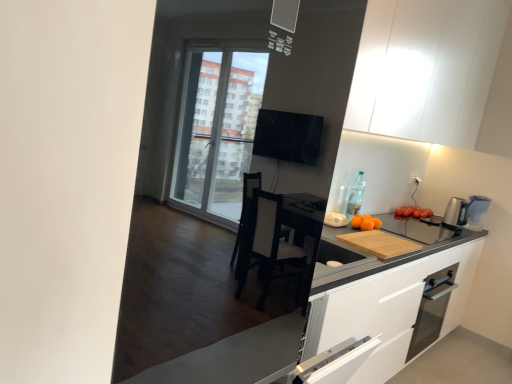
Question: Is wooden cutting board at right wider than white matte cabinet at upper center?

Choices:
 (A) yes
 (B) no

Answer: (A)

Question: Would you say wooden cutting board at right contains white matte cabinet at upper center?

Choices:
 (A) no
 (B) yes

Answer: (A)

Question: Is the position of wooden cutting board at right less distant than that of white matte cabinet at upper center?

Choices:
 (A) yes
 (B) no

Answer: (A)

Question: Is wooden cutting board at right not within white matte cabinet at upper center?

Choices:
 (A) no
 (B) yes

Answer: (B)

Question: Does wooden cutting board at right have a lesser height compared to white matte cabinet at upper center?

Choices:
 (A) no
 (B) yes

Answer: (B)

Question: Is wooden cutting board at right looking in the opposite direction of white matte cabinet at upper center?

Choices:
 (A) no
 (B) yes

Answer: (A)

Question: Would you say wooden cutting board at right is part of white matte cabinet at upper center's contents?

Choices:
 (A) no
 (B) yes

Answer: (A)

Question: Is white matte cabinet at upper center positioned before wooden cutting board at right?

Choices:
 (A) yes
 (B) no

Answer: (B)

Question: Considering the relative sizes of white matte cabinet at upper center and wooden cutting board at right in the image provided, is white matte cabinet at upper center thinner than wooden cutting board at right?

Choices:
 (A) no
 (B) yes

Answer: (B)

Question: Can you confirm if white matte cabinet at upper center is wider than wooden cutting board at right?

Choices:
 (A) no
 (B) yes

Answer: (A)

Question: Is white matte cabinet at upper center with wooden cutting board at right?

Choices:
 (A) yes
 (B) no

Answer: (B)

Question: Is white matte cabinet at upper center aimed at wooden cutting board at right?

Choices:
 (A) yes
 (B) no

Answer: (B)

Question: Can you confirm if orange matte at right is positioned to the right of glass door oven at lower right?

Choices:
 (A) no
 (B) yes

Answer: (A)